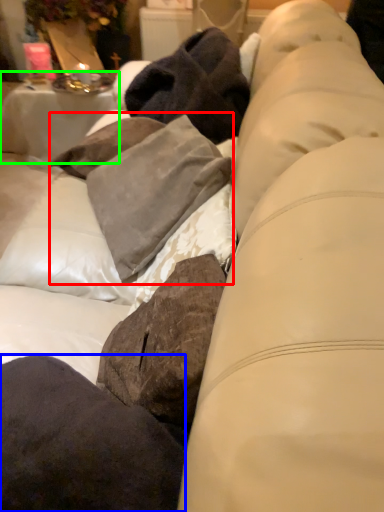
Question: Which is farther away from clothing (highlighted by a red box)? pillow (highlighted by a blue box) or table (highlighted by a green box)?

Choices:
 (A) pillow
 (B) table

Answer: (B)